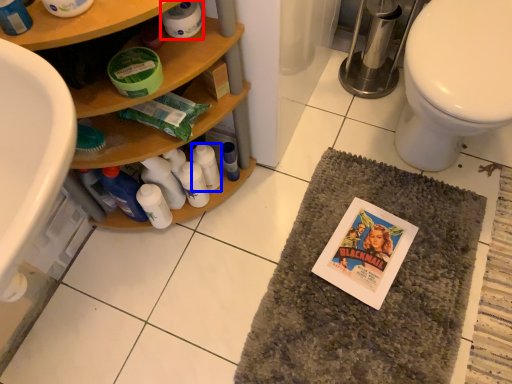
Question: Which point is further to the camera, toilet paper (highlighted by a red box) or bottle (highlighted by a blue box)?

Choices:
 (A) toilet paper
 (B) bottle

Answer: (B)